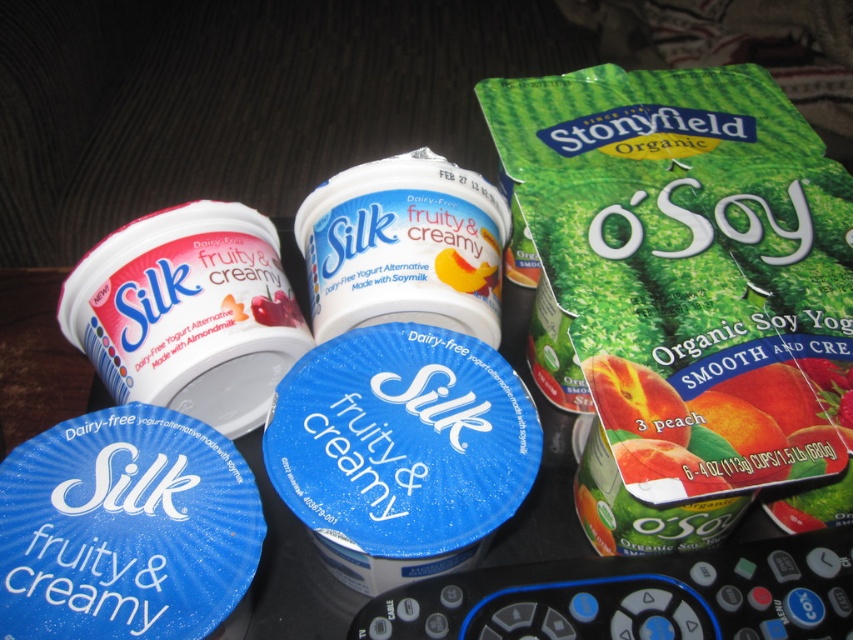
You are organizing a dairy section and need to stack items from tallest to shortest. Given the green matte pouch at upper right and the matte white yogurt at center, which one should be placed first in the stack?

The green matte pouch at upper right should be placed first in the stack since it has a greater height compared to the matte white yogurt at center, making it the tallest item.

You are organizing a dairy section and need to place the matte white yogurt at center and the white matte yogurt at center on a shelf. Which one should you place first to ensure proper spacing?

The matte white yogurt at center is larger than the white matte yogurt at center, so you should place the matte white yogurt at center first to ensure proper spacing.

You are arranging the yogurt alternatives on the dark wooden surface. You need to place a new container between the two points given. Which point should you place it closer to so that it is closer to the viewer? The two points are point (598, 112) and point (463, 237).

You should place the new container closer to point (598, 112) because it is further to the viewer than point (463, 237).